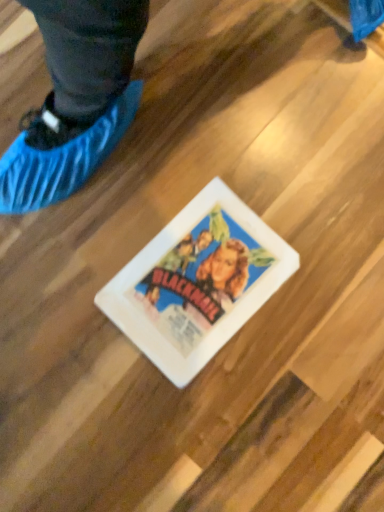
I want to click on free spot in front of white glossy book cover at center, so click(x=213, y=420).